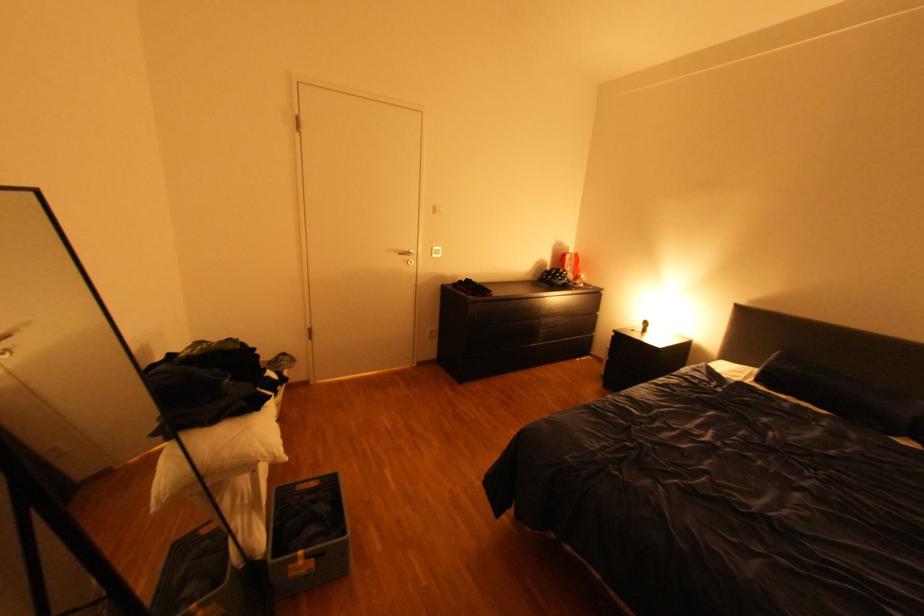
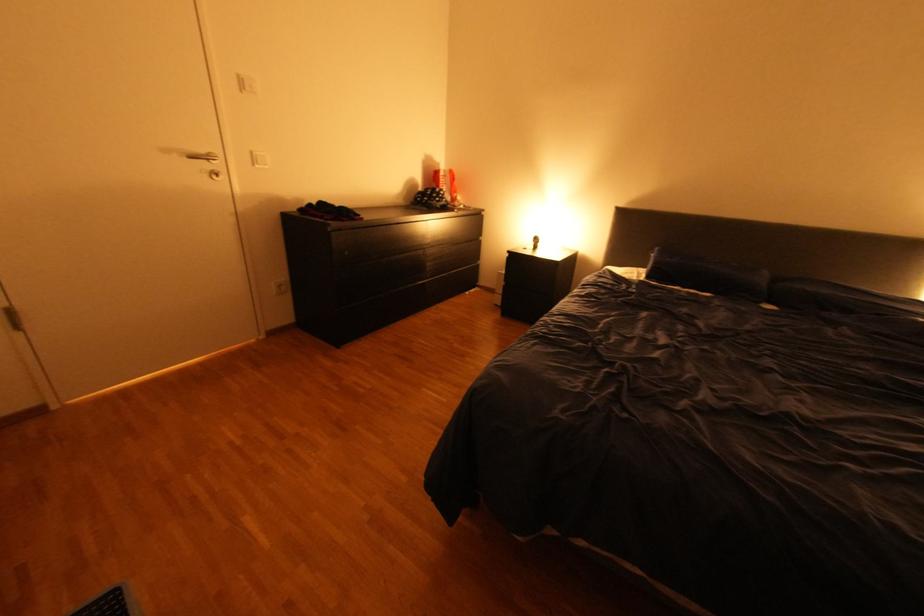
Where in the second image is the point corresponding to point (487, 317) from the first image?

(357, 253)